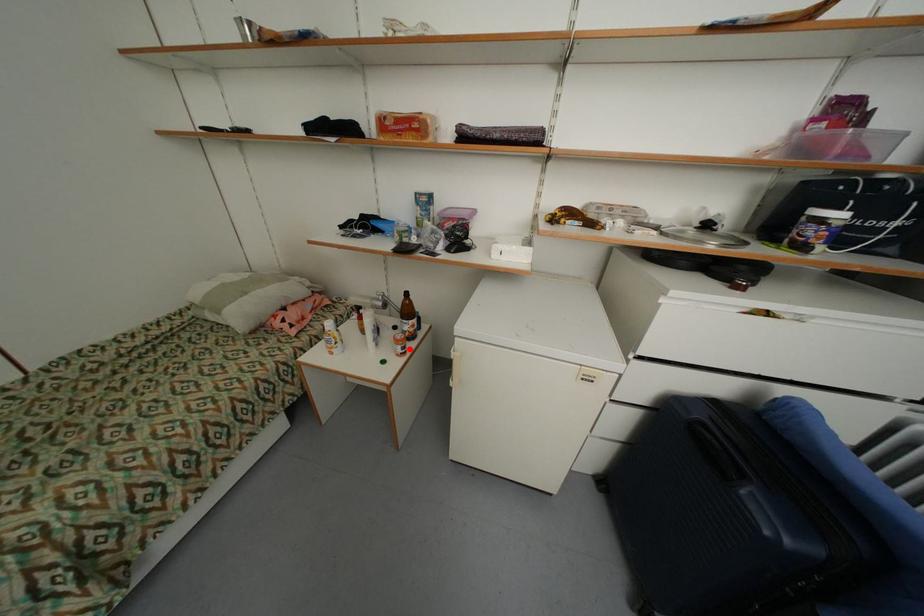
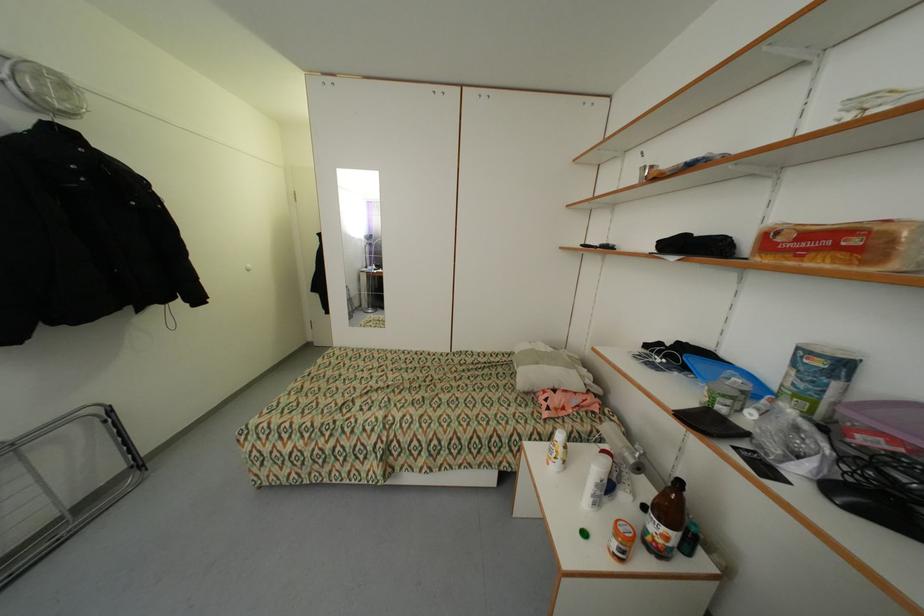
Question: I am providing you with two images of the same scene from different viewpoints. Given a red point in image1, look at the same physical point in image2. Is it:

Choices:
 (A) Closer to the viewpoint
 (B) Farther from the viewpoint

Answer: (B)